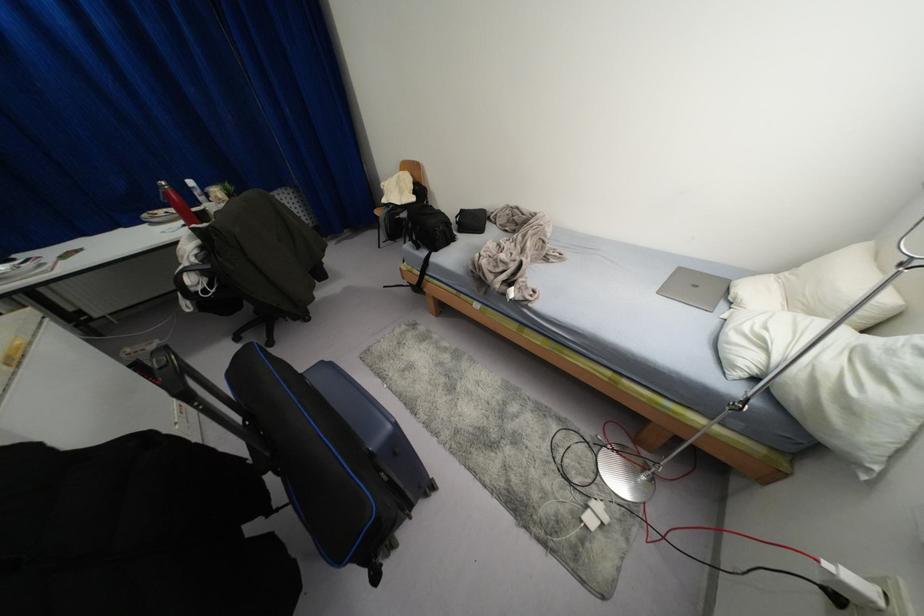
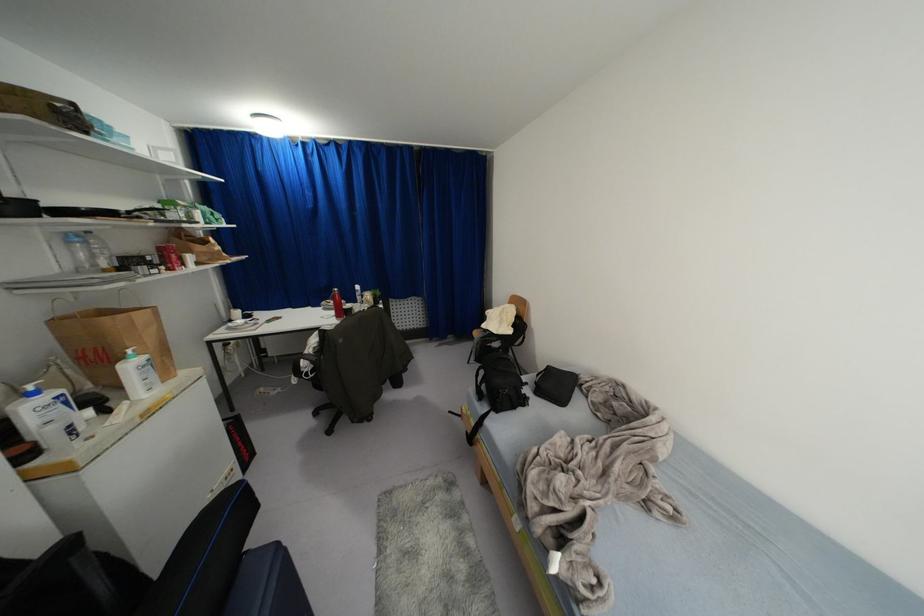
First-person continuous shooting, in which direction is the camera rotating?

The rotation direction of the camera is left-up.